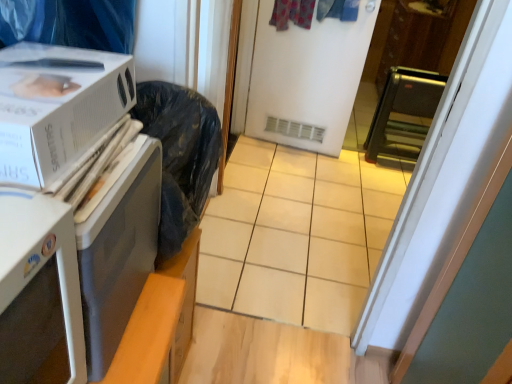
Where is `white plastic microwave at left, the second appliance viewed from the right`? The width and height of the screenshot is (512, 384). white plastic microwave at left, the second appliance viewed from the right is located at coordinates (118, 253).

Is white matte screen door at center shorter than white cardboard box at left?

Incorrect, the height of white matte screen door at center does not fall short of that of white cardboard box at left.

Between white matte screen door at center and white cardboard box at left, which one has smaller width?

white matte screen door at center.

Does point (366, 20) come behind point (8, 163)?

Yes, point (366, 20) is farther from viewer.

This screenshot has width=512, height=384. In order to click on appliance behind the white matte screen door at center in this screenshot , I will do click(403, 111).

From a real-world perspective, is white matte screen door at center physically located above or below black metallic toaster oven at right, the second appliance from the left?

From a real-world perspective, white matte screen door at center is physically above black metallic toaster oven at right, the second appliance from the left.

Is white matte screen door at center to the right of black metallic toaster oven at right, the 1th appliance from the top, from the viewer's perspective?

No, white matte screen door at center is not to the right of black metallic toaster oven at right, the 1th appliance from the top.

Is white matte screen door at center oriented towards black metallic toaster oven at right, the second appliance from the left?

No, white matte screen door at center is not facing towards black metallic toaster oven at right, the second appliance from the left.

How many degrees apart are the facing directions of white matte screen door at center and white plastic microwave at left, the first appliance ordered from the bottom?

100 degrees.

Is white matte screen door at center located outside white plastic microwave at left, placed as the 1th appliance when sorted from left to right?

white matte screen door at center is positioned outside white plastic microwave at left, placed as the 1th appliance when sorted from left to right.

Based on the photo, from a real-world perspective, who is located higher, white matte screen door at center or white plastic microwave at left, the first appliance ordered from the bottom?

white plastic microwave at left, the first appliance ordered from the bottom.

From the image's perspective, which is above, white matte screen door at center or white plastic microwave at left, placed as the 1th appliance when sorted from left to right?

white matte screen door at center appears higher in the image.

Is white cardboard box at left completely or partially outside of white plastic microwave at left, placed as the 1th appliance when sorted from left to right?

Yes, white cardboard box at left is not within white plastic microwave at left, placed as the 1th appliance when sorted from left to right.

Does white cardboard box at left turn towards white plastic microwave at left, placed as the 1th appliance when sorted from left to right?

No, white cardboard box at left does not turn towards white plastic microwave at left, placed as the 1th appliance when sorted from left to right.

From a real-world perspective, is white cardboard box at left beneath white plastic microwave at left, the 2th appliance positioned from the back?

Incorrect, from a real-world perspective, white cardboard box at left is higher than white plastic microwave at left, the 2th appliance positioned from the back.

How much distance is there between white cardboard box at left and white plastic microwave at left, the first appliance ordered from the bottom?

white cardboard box at left and white plastic microwave at left, the first appliance ordered from the bottom, are 7.25 inches apart.

From the image's perspective, is black metallic toaster oven at right, the first appliance in the right-to-left sequence, on white matte screen door at center?

No.

Are black metallic toaster oven at right, the 2th appliance in the bottom-to-top sequence, and white matte screen door at center far apart?

No, black metallic toaster oven at right, the 2th appliance in the bottom-to-top sequence, is not far from white matte screen door at center.

In the scene shown: Between black metallic toaster oven at right, marked as the first appliance in a back-to-front arrangement, and white matte screen door at center, which one has less height?

With less height is black metallic toaster oven at right, marked as the first appliance in a back-to-front arrangement.

Identify the location of appliance located behind the white matte screen door at center. (403, 111).

How many degrees apart are the facing directions of white cardboard box at left and black metallic toaster oven at right, which ranks as the 2th appliance in front-to-back order?

100 degrees.

Can you confirm if white cardboard box at left is smaller than black metallic toaster oven at right, marked as the first appliance in a back-to-front arrangement?

Yes, white cardboard box at left is smaller than black metallic toaster oven at right, marked as the first appliance in a back-to-front arrangement.

From the picture: Which is correct: white cardboard box at left is inside black metallic toaster oven at right, the second appliance from the left, or outside of it?

white cardboard box at left lies outside black metallic toaster oven at right, the second appliance from the left.

Is white cardboard box at left positioned far away from black metallic toaster oven at right, the 2th appliance in the bottom-to-top sequence?

Yes, white cardboard box at left and black metallic toaster oven at right, the 2th appliance in the bottom-to-top sequence, are located far from each other.

Between white plastic microwave at left, which ranks as the first appliance in front-to-back order, and white matte screen door at center, which one has smaller width?

white matte screen door at center.

Considering the relative sizes of white plastic microwave at left, placed as the 1th appliance when sorted from left to right, and white matte screen door at center in the image provided, is white plastic microwave at left, placed as the 1th appliance when sorted from left to right, bigger than white matte screen door at center?

No.

Between white plastic microwave at left, the first appliance ordered from the bottom, and white matte screen door at center, which one appears on the left side from the viewer's perspective?

From the viewer's perspective, white plastic microwave at left, the first appliance ordered from the bottom, appears more on the left side.

Is white plastic microwave at left, the 2th appliance when ordered from top to bottom, touching white matte screen door at center?

No, white plastic microwave at left, the 2th appliance when ordered from top to bottom, is not in contact with white matte screen door at center.

The width and height of the screenshot is (512, 384). I want to click on home appliance below the white matte screen door at center (from the image's perspective), so click(x=57, y=107).

Find the location of a particular element. This screenshot has height=384, width=512. appliance located on the right of white matte screen door at center is located at coordinates (403, 111).

Considering their positions, is white cardboard box at left positioned closer to white plastic microwave at left, the 2th appliance when ordered from top to bottom, than black metallic toaster oven at right, the 2th appliance in the bottom-to-top sequence?

white cardboard box at left is positioned closer to the anchor white plastic microwave at left, the 2th appliance when ordered from top to bottom.

When comparing their distances from white matte screen door at center, does white plastic microwave at left, the 2th appliance positioned from the back, or black metallic toaster oven at right, the first appliance in the right-to-left sequence, seem closer?

black metallic toaster oven at right, the first appliance in the right-to-left sequence, is positioned closer to the anchor white matte screen door at center.

Estimate the real-world distances between objects in this image. Which object is closer to black metallic toaster oven at right, marked as the first appliance in a back-to-front arrangement, white matte screen door at center or white cardboard box at left?

white matte screen door at center is closer to black metallic toaster oven at right, marked as the first appliance in a back-to-front arrangement.

Considering their positions, is white matte screen door at center positioned closer to white plastic microwave at left, the first appliance ordered from the bottom, than black metallic toaster oven at right, marked as the first appliance in a back-to-front arrangement?

The object closer to white plastic microwave at left, the first appliance ordered from the bottom, is white matte screen door at center.

When comparing their distances from black metallic toaster oven at right, the first appliance in the right-to-left sequence, does white plastic microwave at left, placed as the 1th appliance when sorted from left to right, or white matte screen door at center seem further?

Among the two, white plastic microwave at left, placed as the 1th appliance when sorted from left to right, is located further to black metallic toaster oven at right, the first appliance in the right-to-left sequence.

Which object lies further to the anchor point white plastic microwave at left, the 2th appliance when ordered from top to bottom, black metallic toaster oven at right, the second appliance from the left, or white cardboard box at left?

black metallic toaster oven at right, the second appliance from the left, is further to white plastic microwave at left, the 2th appliance when ordered from top to bottom.

Looking at the image, which one is located further to black metallic toaster oven at right, the 1th appliance from the top, white cardboard box at left or white plastic microwave at left, the 2th appliance when ordered from top to bottom?

The object further to black metallic toaster oven at right, the 1th appliance from the top, is white cardboard box at left.

When comparing their distances from white matte screen door at center, does white cardboard box at left or black metallic toaster oven at right, the first appliance in the right-to-left sequence, seem closer?

black metallic toaster oven at right, the first appliance in the right-to-left sequence.

I want to click on appliance between white cardboard box at left and black metallic toaster oven at right, the 2th appliance in the bottom-to-top sequence, in the front-back direction, so click(x=118, y=253).

What are the coordinates of `screen door between white plastic microwave at left, the 2th appliance when ordered from top to bottom, and black metallic toaster oven at right, the 2th appliance in the bottom-to-top sequence, in the front-back direction` in the screenshot? It's located at (307, 79).

Where is `screen door positioned between white cardboard box at left and black metallic toaster oven at right, the 1th appliance from the top, from near to far`? screen door positioned between white cardboard box at left and black metallic toaster oven at right, the 1th appliance from the top, from near to far is located at coordinates (307, 79).

This screenshot has width=512, height=384. What are the coordinates of `appliance between white cardboard box at left and white matte screen door at center in the front-back direction` in the screenshot? It's located at coord(118,253).